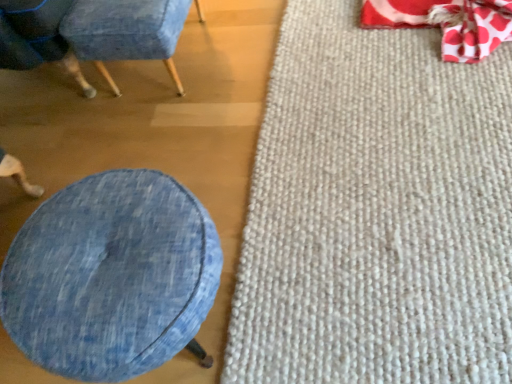
Question: Can you confirm if denim fabric ottoman at lower left is bigger than white textured mat at right?

Choices:
 (A) yes
 (B) no

Answer: (A)

Question: Are denim fabric ottoman at lower left and white textured mat at right located far from each other?

Choices:
 (A) yes
 (B) no

Answer: (B)

Question: Is denim fabric ottoman at lower left thinner than white textured mat at right?

Choices:
 (A) yes
 (B) no

Answer: (A)

Question: Does denim fabric ottoman at lower left appear on the right side of white textured mat at right?

Choices:
 (A) no
 (B) yes

Answer: (A)

Question: Can you confirm if denim fabric ottoman at lower left is shorter than white textured mat at right?

Choices:
 (A) yes
 (B) no

Answer: (B)

Question: From the image's perspective, is red polka dot fabric bean bag chair at upper right above or below denim fabric at left, which appears as the 2th chair when viewed from the right?

Choices:
 (A) below
 (B) above

Answer: (A)

Question: In terms of size, does red polka dot fabric bean bag chair at upper right appear bigger or smaller than denim fabric at left, which appears as the 2th chair when viewed from the right?

Choices:
 (A) big
 (B) small

Answer: (B)

Question: Based on their positions, is red polka dot fabric bean bag chair at upper right located to the left or right of denim fabric at left, which is counted as the 1th chair, starting from the left?

Choices:
 (A) right
 (B) left

Answer: (A)

Question: Considering the positions of red polka dot fabric bean bag chair at upper right and denim fabric at left, which is counted as the 1th chair, starting from the left, in the image, is red polka dot fabric bean bag chair at upper right taller or shorter than denim fabric at left, which is counted as the 1th chair, starting from the left,?

Choices:
 (A) short
 (B) tall

Answer: (A)

Question: Is denim fabric at left, which appears as the 2th chair when viewed from the right, wider or thinner than denim fabric chair at upper left, which is the second chair from left to right?

Choices:
 (A) wide
 (B) thin

Answer: (A)

Question: Is point (13, 48) positioned closer to the camera than point (86, 14)?

Choices:
 (A) closer
 (B) farther

Answer: (B)

Question: Would you say denim fabric at left, which is counted as the 1th chair, starting from the left, is to the left or to the right of denim fabric chair at upper left, which is the second chair from left to right, in the picture?

Choices:
 (A) left
 (B) right

Answer: (A)

Question: Is denim fabric at left, which is counted as the 1th chair, starting from the left, in front of or behind denim fabric chair at upper left, which is the second chair from left to right, in the image?

Choices:
 (A) front
 (B) behind

Answer: (A)

Question: From a real-world perspective, is red polka dot fabric bean bag chair at upper right above or below denim fabric chair at upper left, which is the second chair from left to right?

Choices:
 (A) above
 (B) below

Answer: (B)

Question: From the image's perspective, is red polka dot fabric bean bag chair at upper right positioned above or below denim fabric chair at upper left, the first chair in the right-to-left sequence?

Choices:
 (A) below
 (B) above

Answer: (A)